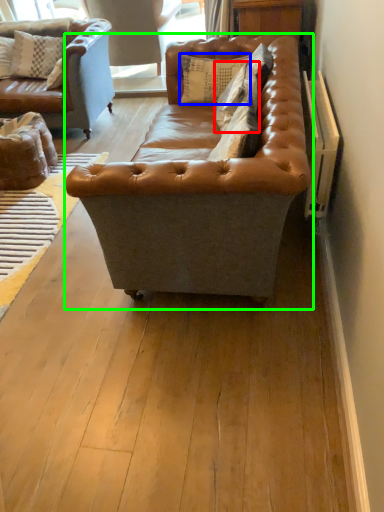
Question: Considering the real-world distances, which object is farthest from pillow (highlighted by a red box)? pillow (highlighted by a blue box) or studio couch (highlighted by a green box)?

Choices:
 (A) pillow
 (B) studio couch

Answer: (B)